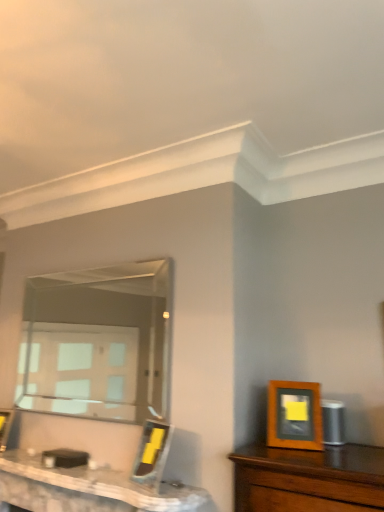
Where is `free location above white marble table at lower left (from a real-world perspective)`? free location above white marble table at lower left (from a real-world perspective) is located at coordinates (82, 468).